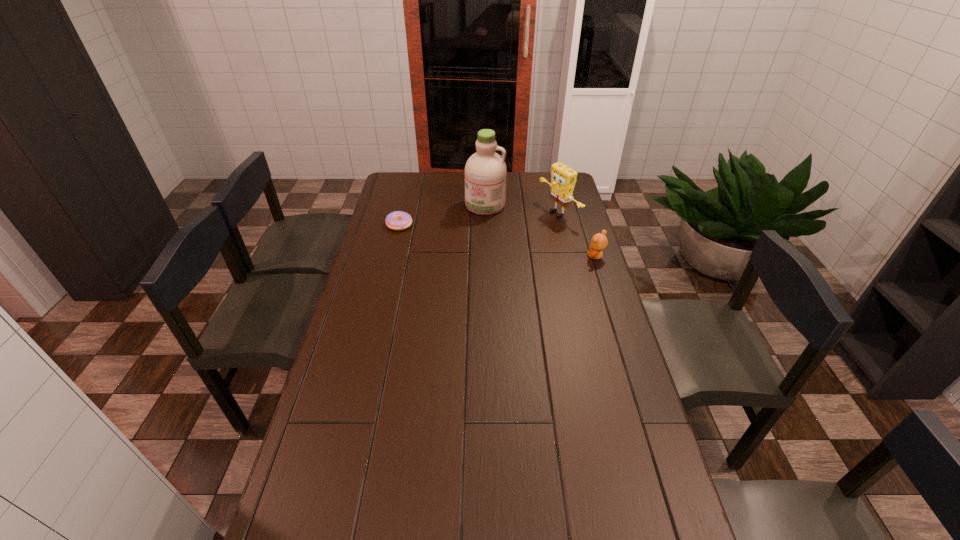
Image resolution: width=960 pixels, height=540 pixels. In order to click on vacant area between the cleansing agent and the second shortest object in this screenshot , I will do `click(540, 231)`.

Locate an element on the screen. vacant region between the second tallest object and the tallest object is located at coordinates (522, 209).

This screenshot has height=540, width=960. I want to click on free spot between the tallest object and the shortest object, so click(443, 215).

Where is `free space that is in between the leftmost object and the sponge`? The height and width of the screenshot is (540, 960). free space that is in between the leftmost object and the sponge is located at coordinates (479, 219).

Identify the location of empty space between the second object from left to right and the second shortest object. (540, 231).

Where is `vacant space in between the third object from right to left and the nearest object`? vacant space in between the third object from right to left and the nearest object is located at coordinates (540, 231).

Locate which object ranks third in proximity to the nearest object. Please provide its 2D coordinates. Your answer should be formatted as a tuple, i.e. [(x, y)], where the tuple contains the x and y coordinates of a point satisfying the conditions above.

[(398, 220)]

Identify which object is the third nearest to the nearest object. Please provide its 2D coordinates. Your answer should be formatted as a tuple, i.e. [(x, y)], where the tuple contains the x and y coordinates of a point satisfying the conditions above.

[(398, 220)]

This screenshot has width=960, height=540. Find the location of `free region that satisfies the following two spatial constraints: 1. on the front side of the cleansing agent; 2. on the face of the teddy bear`. free region that satisfies the following two spatial constraints: 1. on the front side of the cleansing agent; 2. on the face of the teddy bear is located at coordinates (486, 256).

Where is `blank space that satisfies the following two spatial constraints: 1. on the front side of the cleansing agent; 2. on the face of the teddy bear`? blank space that satisfies the following two spatial constraints: 1. on the front side of the cleansing agent; 2. on the face of the teddy bear is located at coordinates (486, 256).